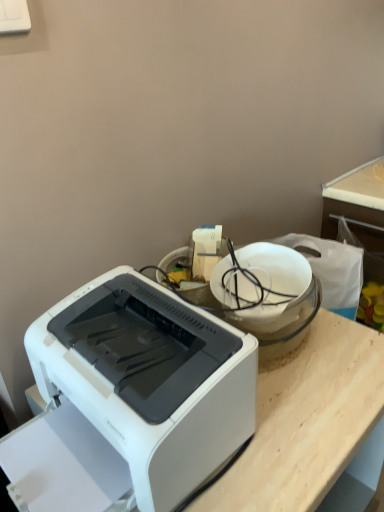
This screenshot has width=384, height=512. What are the coordinates of `free location to the right of white plastic printer at lower left` in the screenshot? It's located at (301, 423).